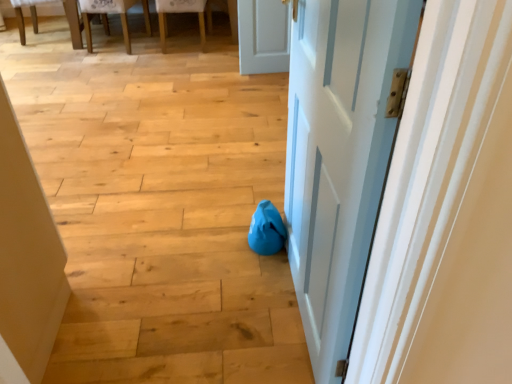
The width and height of the screenshot is (512, 384). Identify the location of vacant area on the back side of white painted wood door at center. (240, 226).